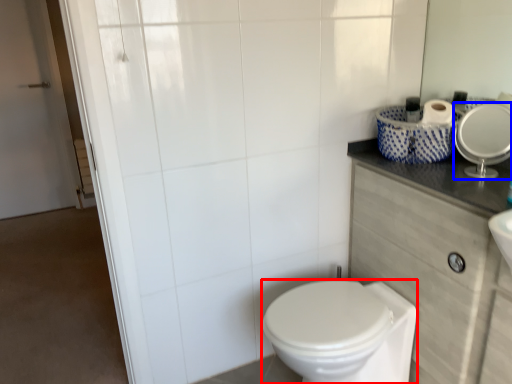
Question: Which object is closer to the camera taking this photo, bidet (highlighted by a red box) or mirror (highlighted by a blue box)?

Choices:
 (A) bidet
 (B) mirror

Answer: (A)